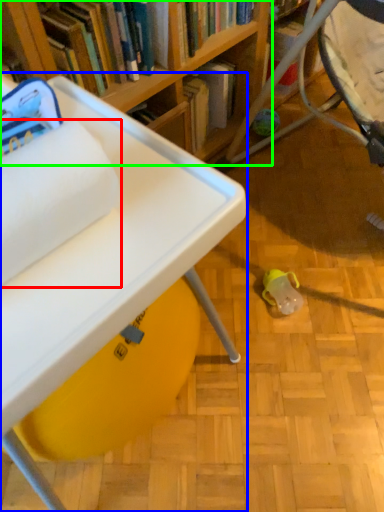
Question: Based on their relative distances, which object is farther from toilet paper (highlighted by a red box)? Choose from table (highlighted by a blue box) and bookcase (highlighted by a green box).

Choices:
 (A) table
 (B) bookcase

Answer: (B)